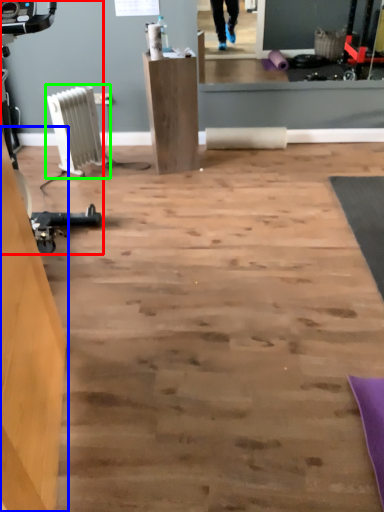
Question: Based on their relative distances, which object is farther from sport equipment (highlighted by a red box)? Choose from furniture (highlighted by a blue box) and radiator (highlighted by a green box).

Choices:
 (A) furniture
 (B) radiator

Answer: (A)